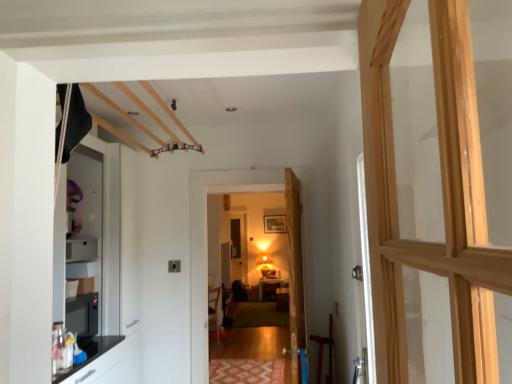
In order to click on wooden door at center, the 1th door positioned from the front in this screenshot , I will do `click(295, 271)`.

This screenshot has width=512, height=384. Describe the element at coordinates (295, 271) in the screenshot. I see `wooden door at center, the 1th door positioned from the front` at that location.

The image size is (512, 384). What do you see at coordinates (214, 309) in the screenshot?
I see `matte wooden chair at center` at bounding box center [214, 309].

Locate an element on the screen. The height and width of the screenshot is (384, 512). matte wooden table at center is located at coordinates (270, 288).

The image size is (512, 384). I want to click on patterned carpet at center, so click(x=246, y=371).

What are the coordinates of `wooden door at center, marked as the second door in a back-to-front arrangement` in the screenshot? It's located at [x=295, y=271].

Is matte wooden table at center located within wooden door at center, the 1th door positioned from the front?

No, matte wooden table at center is not surrounded by wooden door at center, the 1th door positioned from the front.

Looking at this image, considering the positions of objects wooden door at center, the 1th door positioned from the front, and matte wooden table at center in the image provided, who is more to the left, wooden door at center, the 1th door positioned from the front, or matte wooden table at center?

From the viewer's perspective, wooden door at center, the 1th door positioned from the front, appears more on the left side.

From a real-world perspective, relative to matte wooden table at center, is wooden door at center, marked as the second door in a back-to-front arrangement, vertically above or below?

Clearly, from a real-world perspective, wooden door at center, marked as the second door in a back-to-front arrangement, is above matte wooden table at center.

Is matte wooden chair at center next to wooden door at center, the 1th door positioned from the front, and touching it?

No, matte wooden chair at center is not touching wooden door at center, the 1th door positioned from the front.

Is matte wooden chair at center outside of wooden door at center, the 1th door positioned from the front?

Absolutely, matte wooden chair at center is external to wooden door at center, the 1th door positioned from the front.

How many degrees apart are the facing directions of matte wooden chair at center and wooden door at center, marked as the second door in a back-to-front arrangement?

They differ by 53.8 degrees in their facing directions.

Is matte wooden chair at center wider than wooden door at center, marked as the second door in a back-to-front arrangement?

Indeed, matte wooden chair at center has a greater width compared to wooden door at center, marked as the second door in a back-to-front arrangement.

Consider the image. Considering the relative positions of matte wooden table at center and matte wooden chair at center in the image provided, is matte wooden table at center in front of matte wooden chair at center?

No, matte wooden table at center is behind matte wooden chair at center.

From a real-world perspective, is matte wooden table at center physically above matte wooden chair at center?

No, from a real-world perspective, matte wooden table at center is not on top of matte wooden chair at center.

Does matte wooden table at center contain matte wooden chair at center?

That's incorrect, matte wooden chair at center is not inside matte wooden table at center.

Considering the sizes of objects matte wooden table at center and matte wooden chair at center in the image provided, who is wider, matte wooden table at center or matte wooden chair at center?

matte wooden chair at center is wider.

Could you tell me if wooden door at center, the first door positioned from the back, is turned towards wooden door at center, the 1th door positioned from the front?

Yes, wooden door at center, the first door positioned from the back, is oriented towards wooden door at center, the 1th door positioned from the front.

Is wooden door at center, the first door positioned from the back, in contact with wooden door at center, marked as the second door in a back-to-front arrangement?

No.

Which is in front, point (250, 174) or point (295, 176)?

The point (295, 176) is more forward.

Locate an element on the screen. table on the right of wooden door at center, the 2th door when ordered from front to back is located at coordinates (270, 288).

From the image's perspective, would you say wooden door at center, the 2th door when ordered from front to back, is shown under matte wooden table at center?

No.

Measure the distance between wooden door at center, the first door positioned from the back, and matte wooden table at center.

A distance of 9.43 feet exists between wooden door at center, the first door positioned from the back, and matte wooden table at center.

Are wooden door at center, the first door positioned from the back, and matte wooden table at center located far from each other?

wooden door at center, the first door positioned from the back, is far away from matte wooden table at center.

Between matte wooden chair at center and wooden door at center, the 2th door when ordered from front to back, which one appears on the left side from the viewer's perspective?

matte wooden chair at center is more to the left.

Considering the positions of point (216, 287) and point (302, 178), is point (216, 287) closer or farther from the camera than point (302, 178)?

Clearly, point (216, 287) is more distant from the camera than point (302, 178).

Where is `the 2nd door positioned above the matte wooden chair at center (from a real-world perspective)`? This screenshot has width=512, height=384. the 2nd door positioned above the matte wooden chair at center (from a real-world perspective) is located at coordinates (207, 246).

Is matte wooden chair at center far away from wooden door at center, the first door positioned from the back?

Indeed, matte wooden chair at center is not near wooden door at center, the first door positioned from the back.

Can you confirm if wooden door at center, the 1th door positioned from the front, is thinner than wooden door at center, the first door positioned from the back?

Incorrect, the width of wooden door at center, the 1th door positioned from the front, is not less than that of wooden door at center, the first door positioned from the back.

Is wooden door at center, the 1th door positioned from the front, oriented away from wooden door at center, the first door positioned from the back?

No, wooden door at center, the 1th door positioned from the front, is not facing the opposite direction of wooden door at center, the first door positioned from the back.

Which is less distant, (288, 187) or (200, 223)?

Point (288, 187) appears to be closer to the viewer than point (200, 223).

Image resolution: width=512 pixels, height=384 pixels. Find the location of `the 2nd door in front when counting from the matte wooden table at center`. the 2nd door in front when counting from the matte wooden table at center is located at coordinates (295, 271).

Image resolution: width=512 pixels, height=384 pixels. Find the location of `furniture behind the wooden door at center, the 1th door positioned from the front`. furniture behind the wooden door at center, the 1th door positioned from the front is located at coordinates (214, 309).

Estimate the real-world distances between objects in this image. Which object is further from patterned carpet at center, wooden door at center, the 2th door when ordered from front to back, or matte wooden chair at center?

The object further to patterned carpet at center is matte wooden chair at center.

Looking at the image, which one is located further to matte wooden table at center, patterned carpet at center or matte wooden chair at center?

Among the two, patterned carpet at center is located further to matte wooden table at center.

Looking at the image, which one is located further to wooden door at center, marked as the second door in a back-to-front arrangement, patterned carpet at center or matte wooden chair at center?

matte wooden chair at center lies further to wooden door at center, marked as the second door in a back-to-front arrangement, than the other object.

Looking at the image, which one is located closer to matte wooden chair at center, wooden door at center, the first door positioned from the back, or patterned carpet at center?

Based on the image, patterned carpet at center appears to be nearer to matte wooden chair at center.

Based on their spatial positions, is wooden door at center, the 1th door positioned from the front, or matte wooden chair at center closer to patterned carpet at center?

The object closer to patterned carpet at center is wooden door at center, the 1th door positioned from the front.

Looking at the image, which one is located further to wooden door at center, the 1th door positioned from the front, matte wooden chair at center or patterned carpet at center?

Based on the image, matte wooden chair at center appears to be further to wooden door at center, the 1th door positioned from the front.

From the image, which object appears to be farther from wooden door at center, the 2th door when ordered from front to back, patterned carpet at center or matte wooden table at center?

Among the two, matte wooden table at center is located further to wooden door at center, the 2th door when ordered from front to back.

Looking at the image, which one is located closer to patterned carpet at center, wooden door at center, the 2th door when ordered from front to back, or wooden door at center, marked as the second door in a back-to-front arrangement?

wooden door at center, the 2th door when ordered from front to back.

Find the location of a particular element. The width and height of the screenshot is (512, 384). mat between wooden door at center, the first door positioned from the back, and matte wooden chair at center in the front-back direction is located at coordinates pos(246,371).

Identify the location of furniture between patterned carpet at center and matte wooden table at center along the z-axis. (214, 309).

You are a GUI agent. You are given a task and a screenshot of the screen. Output one action in this format:
    pyautogui.click(x=<x>, y=<y>)
    Task: Click on the furniture between wooden door at center, marked as the second door in a back-to-front arrangement, and matte wooden table at center from front to back
    This screenshot has width=512, height=384.
    Given the screenshot: What is the action you would take?
    pyautogui.click(x=214, y=309)

Where is `mat positioned between wooden door at center, the 1th door positioned from the front, and matte wooden chair at center from near to far`? The image size is (512, 384). mat positioned between wooden door at center, the 1th door positioned from the front, and matte wooden chair at center from near to far is located at coordinates (246, 371).